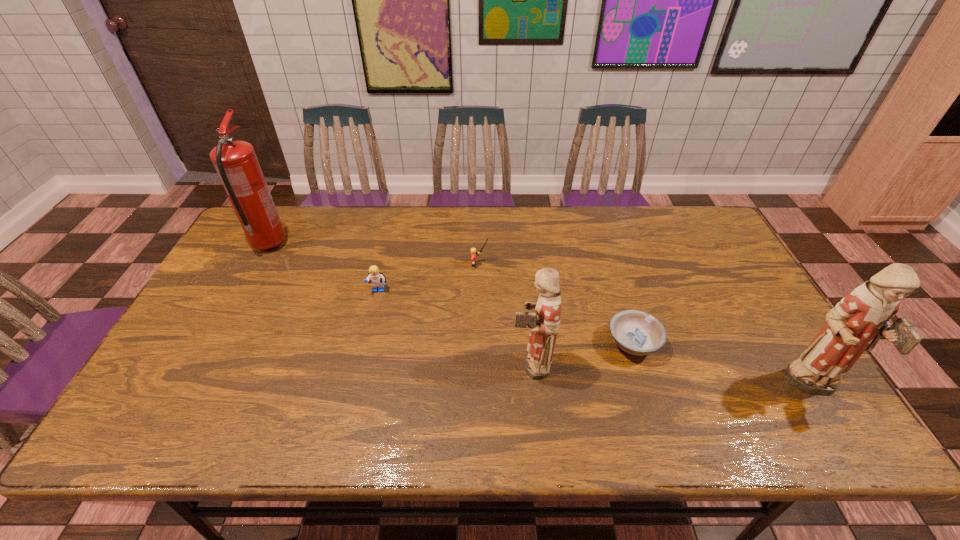
Find the location of a particular element. The width and height of the screenshot is (960, 540). object present at the far edge is located at coordinates (235, 161).

Where is `object situated at the left edge`? The image size is (960, 540). object situated at the left edge is located at coordinates (235, 161).

In order to click on object that is at the right edge in this screenshot , I will do `click(862, 317)`.

The width and height of the screenshot is (960, 540). What are the coordinates of `object at the far left corner` in the screenshot? It's located at (235, 161).

Locate an element on the screen. This screenshot has height=540, width=960. object at the near right corner is located at coordinates (862, 317).

Where is `vacant area at the far edge of the desktop`? vacant area at the far edge of the desktop is located at coordinates (476, 222).

The image size is (960, 540). In the image, there is a desktop. Find the location of `blank space at the near edge`. blank space at the near edge is located at coordinates (299, 379).

The width and height of the screenshot is (960, 540). In the image, there is a desktop. In order to click on vacant region at the left edge in this screenshot , I will do `click(252, 295)`.

Find the location of a particular element. blank space at the far right corner is located at coordinates (725, 246).

This screenshot has height=540, width=960. I want to click on unoccupied position between the fire extinguisher and the left Lego, so click(x=324, y=268).